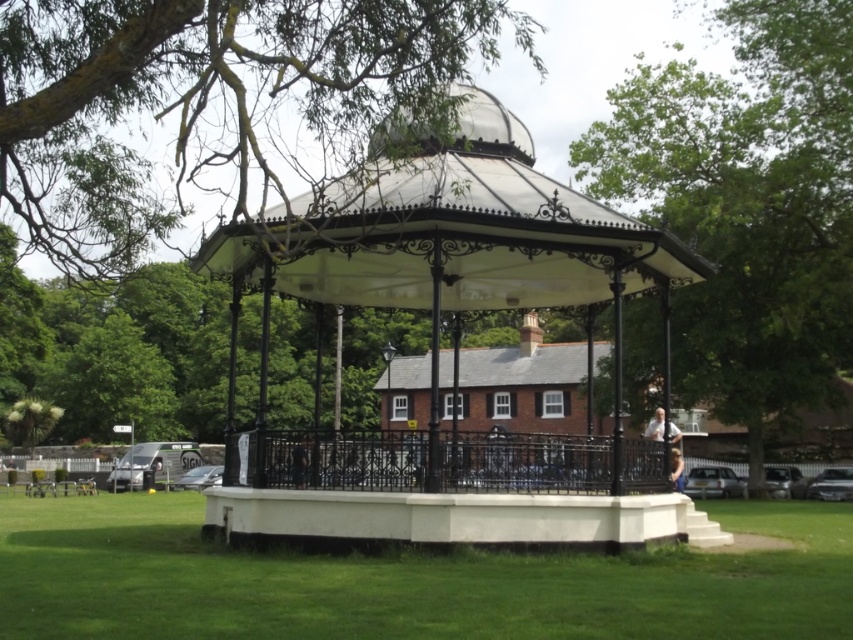
You are standing in the park and see both the white stone gazebo at center and the black wrought iron gazebo at center. Which one is positioned to the left when viewed from your current perspective?

The white stone gazebo at center is positioned to the left of the black wrought iron gazebo at center.

You are planning to set up a picnic blanket in the park. You want to ensure it is under an area that provides shade. Given the current position of the green leafy tree at upper left and the black wrought iron gazebo at center, which one would provide more shade for your picnic blanket?

The green leafy tree at upper left is above the black wrought iron gazebo at center, so the tree would cast a larger shadow over the gazebo area. Therefore, placing the picnic blanket under the black wrought iron gazebo at center would be in the shade provided by the tree.

You are standing at the bandstand and looking towards the trees in the background. There are two points marked in the scene, point (90, 189) and point (136, 504). Which point is nearer to your current position?

Point (90, 189) is closer to the camera than point (136, 504), so the point (90, 189) is nearer to your current position.